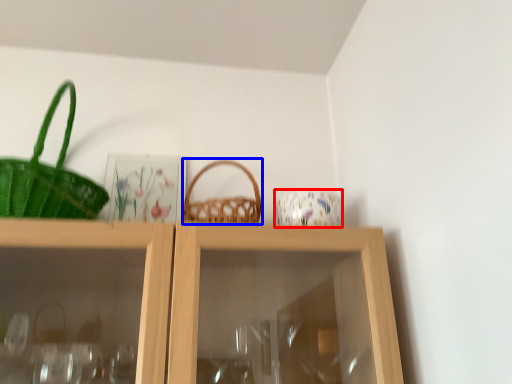
Question: Which object appears farthest to the camera in this image, tableware (highlighted by a red box) or picnic basket (highlighted by a blue box)?

Choices:
 (A) tableware
 (B) picnic basket

Answer: (A)